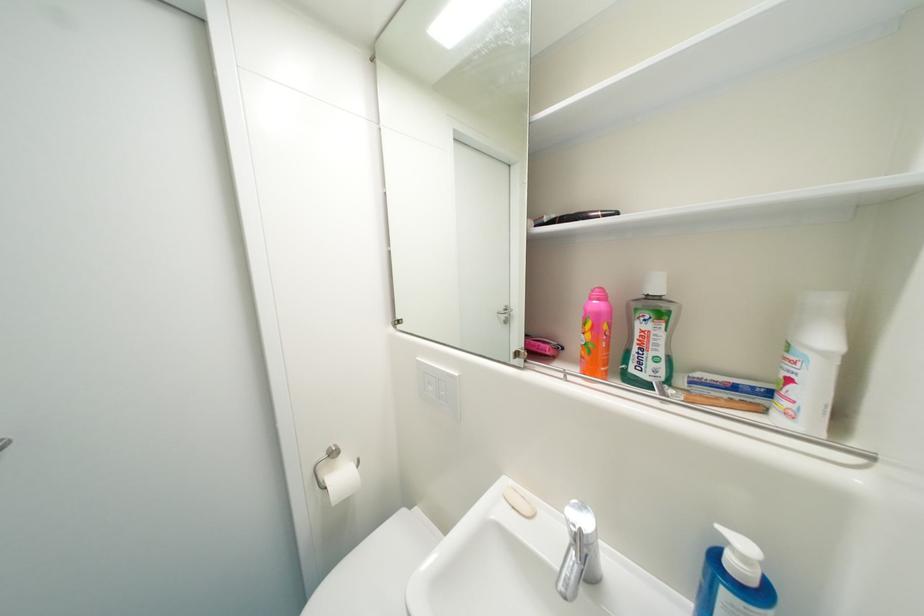
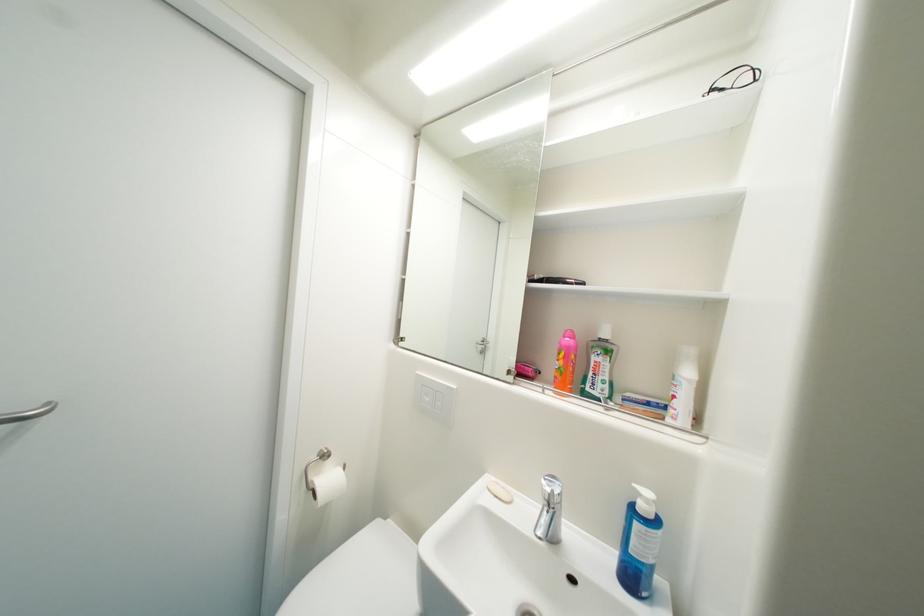
Find the pixel in the second image that matches pixel 750 560 in the first image.

(653, 503)